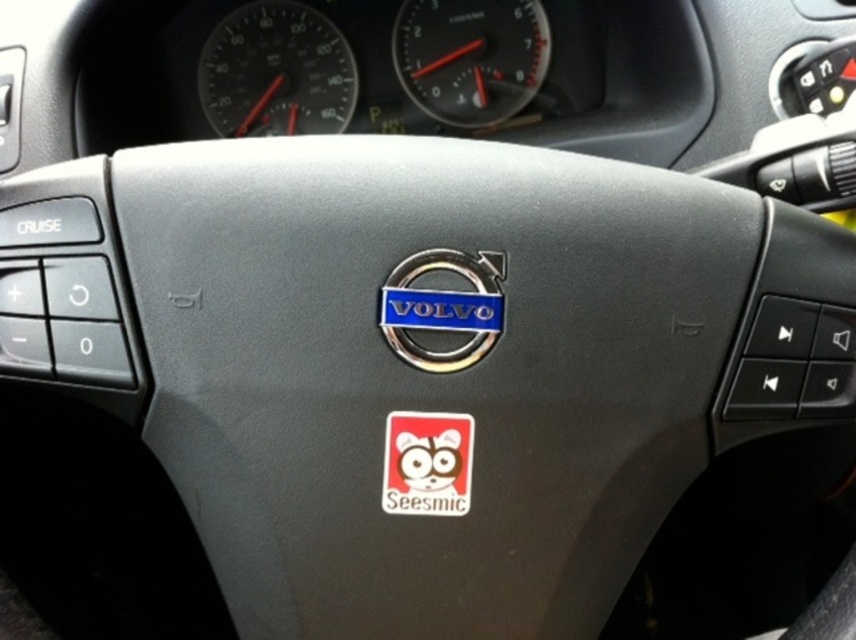
Question: From the image, what is the correct spatial relationship of matte black speedometer at upper center in relation to red matte sticker at center?

Choices:
 (A) left
 (B) right

Answer: (A)

Question: Which object appears farthest from the camera in this image?

Choices:
 (A) metallic silver speedometer at upper center
 (B) red matte sticker at center

Answer: (A)

Question: Is matte black speedometer at upper center wider than red matte sticker at center?

Choices:
 (A) no
 (B) yes

Answer: (B)

Question: Which object is the farthest from the red matte sticker at center?

Choices:
 (A) matte black speedometer at upper center
 (B) metallic silver speedometer at upper center

Answer: (A)

Question: In this image, where is metallic silver speedometer at upper center located relative to red matte sticker at center?

Choices:
 (A) left
 (B) right

Answer: (B)

Question: Based on their relative distances, which object is farther from the red matte sticker at center?

Choices:
 (A) matte black speedometer at upper center
 (B) metallic silver speedometer at upper center

Answer: (A)